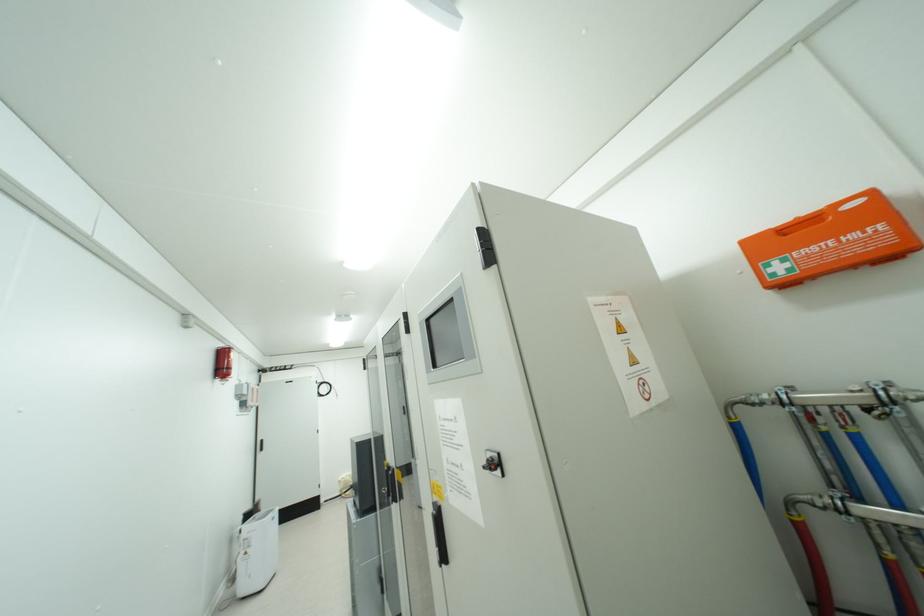
At what (x,y) coordinates should I click in order to perform the action: click on orange kit handle. Please return your answer as a coordinate pair (x, y). This screenshot has height=616, width=924. Looking at the image, I should click on (801, 223).